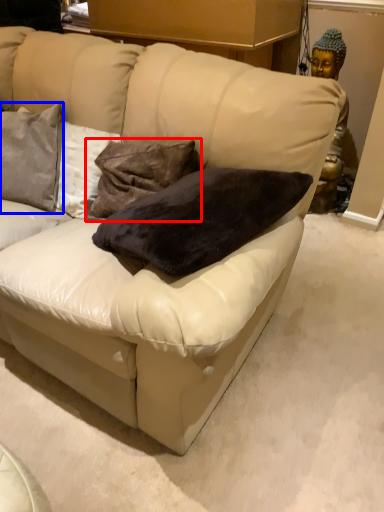
Question: Which object appears farthest to the camera in this image, pillow (highlighted by a red box) or pillow (highlighted by a blue box)?

Choices:
 (A) pillow
 (B) pillow

Answer: (B)